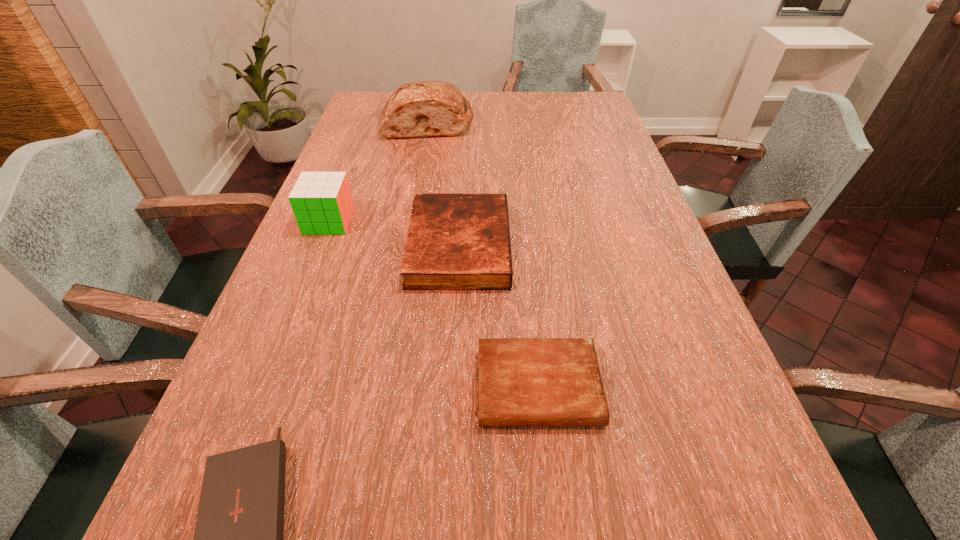
Identify the location of cube at the left edge. The height and width of the screenshot is (540, 960). [322, 203].

Find the location of `object that is at the far left corner`. object that is at the far left corner is located at coordinates (426, 108).

Image resolution: width=960 pixels, height=540 pixels. Identify the location of vacant space at the far edge of the desktop. (x=495, y=116).

In the image, there is a desktop. Identify the location of vacant area at the left edge. The height and width of the screenshot is (540, 960). (372, 208).

Where is `free location at the right edge`? free location at the right edge is located at coordinates (605, 246).

The height and width of the screenshot is (540, 960). In order to click on vacant space in between the tallest Bible and the cube in this screenshot , I will do `click(395, 233)`.

I want to click on free space between the cube and the bread, so click(x=379, y=172).

Identify the location of free space between the farthest Bible and the tallest object. This screenshot has height=540, width=960. (444, 184).

Locate an element on the screen. The image size is (960, 540). the second closest object relative to the leftmost Bible is located at coordinates (455, 241).

What are the coordinates of `the third closest object to the tallest Bible` in the screenshot? It's located at (239, 532).